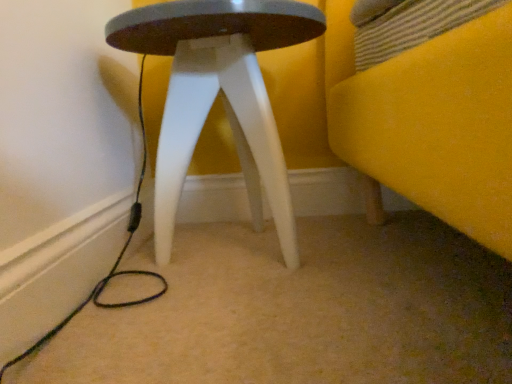
At what (x,y) coordinates should I click in order to perform the action: click on free space between matte white stool at center and black cable at lower left. Please return your answer as a coordinate pair (x, y). This screenshot has width=512, height=384. Looking at the image, I should click on (169, 300).